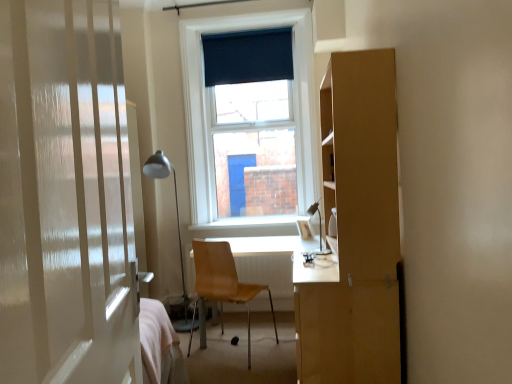
The height and width of the screenshot is (384, 512). Describe the element at coordinates (248, 56) in the screenshot. I see `dark blue fabric at upper center` at that location.

Where is `wooden chair at center`? The width and height of the screenshot is (512, 384). wooden chair at center is located at coordinates (223, 282).

Locate an element on the screen. Image resolution: width=512 pixels, height=384 pixels. matte silver table lamp at center, which appears as the 2th table lamp when viewed from the left is located at coordinates (319, 228).

Describe the element at coordinates (177, 225) in the screenshot. I see `metallic silver table lamp at left, arranged as the 2th table lamp when viewed from the front` at that location.

What do you see at coordinates (65, 196) in the screenshot?
I see `white glossy door at left` at bounding box center [65, 196].

The image size is (512, 384). I want to click on white smooth window sill at center, so click(x=248, y=226).

Identify the location of dark blue fabric at upper center. (248, 56).

Is point (119, 212) positioned after point (215, 83)?

No, it is not.

Between white glossy door at left and dark blue fabric at upper center, which one appears on the left side from the viewer's perspective?

white glossy door at left.

Which object is wider, white glossy door at left or dark blue fabric at upper center?

Wider between the two is white glossy door at left.

Locate an element on the screen. Image resolution: width=512 pixels, height=384 pixels. door located above the wooden chair at center (from the image's perspective) is located at coordinates (65, 196).

How different are the orientations of wooden chair at center and white glossy door at left in degrees?

They differ by 53.8 degrees in their facing directions.

From the image's perspective, which one is positioned lower, wooden chair at center or white glossy door at left?

From the image's view, wooden chair at center is below.

Does wooden chair at center touch white glossy door at left?

No, wooden chair at center is not next to white glossy door at left.

Looking at the image, does dark blue fabric at upper center seem bigger or smaller compared to metallic silver table lamp at left, placed as the second table lamp when sorted from right to left?

dark blue fabric at upper center is smaller than metallic silver table lamp at left, placed as the second table lamp when sorted from right to left.

What are the coordinates of `curtain above the metallic silver table lamp at left, acting as the 1th table lamp starting from the back (from a real-world perspective)` in the screenshot? It's located at pyautogui.click(x=248, y=56).

Does dark blue fabric at upper center have a greater width compared to metallic silver table lamp at left, placed as the second table lamp when sorted from right to left?

No.

Is metallic silver table lamp at left, arranged as the 2th table lamp when viewed from the front, turned away from matte silver table lamp at center, which appears as the 2th table lamp when viewed from the left?

metallic silver table lamp at left, arranged as the 2th table lamp when viewed from the front, does not have its back to matte silver table lamp at center, which appears as the 2th table lamp when viewed from the left.

From the image's perspective, relative to matte silver table lamp at center, which is counted as the first table lamp, starting from the front, is metallic silver table lamp at left, arranged as the 2th table lamp when viewed from the front, above or below?

metallic silver table lamp at left, arranged as the 2th table lamp when viewed from the front, is below matte silver table lamp at center, which is counted as the first table lamp, starting from the front.

From a real-world perspective, is metallic silver table lamp at left, acting as the 1th table lamp starting from the back, positioned under matte silver table lamp at center, which is the first table lamp from right to left, based on gravity?

Yes, from a real-world perspective, metallic silver table lamp at left, acting as the 1th table lamp starting from the back, is beneath matte silver table lamp at center, which is the first table lamp from right to left.

In the scene shown: Does metallic silver table lamp at left, acting as the 1th table lamp starting from the back, come behind matte silver table lamp at center, the second table lamp when ordered from back to front?

Yes, metallic silver table lamp at left, acting as the 1th table lamp starting from the back, is further from the camera.

What's the angular difference between metallic silver table lamp at left, the 1th table lamp in the left-to-right sequence, and light brown wooden desk at center's facing directions?

The angular difference between metallic silver table lamp at left, the 1th table lamp in the left-to-right sequence, and light brown wooden desk at center is 0.000375 degrees.

Considering the sizes of metallic silver table lamp at left, placed as the second table lamp when sorted from right to left, and light brown wooden desk at center in the image, is metallic silver table lamp at left, placed as the second table lamp when sorted from right to left, wider or thinner than light brown wooden desk at center?

Considering their sizes, metallic silver table lamp at left, placed as the second table lamp when sorted from right to left, looks slimmer than light brown wooden desk at center.

Is metallic silver table lamp at left, arranged as the 2th table lamp when viewed from the front, spatially inside light brown wooden desk at center, or outside of it?

metallic silver table lamp at left, arranged as the 2th table lamp when viewed from the front, exists outside the volume of light brown wooden desk at center.

Are metallic silver table lamp at left, the 1th table lamp in the left-to-right sequence, and light brown wooden desk at center far apart?

Yes, metallic silver table lamp at left, the 1th table lamp in the left-to-right sequence, and light brown wooden desk at center are located far from each other.

Is metallic silver table lamp at left, the 1th table lamp in the left-to-right sequence, aimed at white smooth window sill at center?

No, metallic silver table lamp at left, the 1th table lamp in the left-to-right sequence, is not oriented towards white smooth window sill at center.

Is metallic silver table lamp at left, the 1th table lamp in the left-to-right sequence, directly adjacent to white smooth window sill at center?

No, metallic silver table lamp at left, the 1th table lamp in the left-to-right sequence, is not in contact with white smooth window sill at center.

From the image's perspective, relative to white smooth window sill at center, is metallic silver table lamp at left, acting as the 1th table lamp starting from the back, above or below?

From the image's perspective, metallic silver table lamp at left, acting as the 1th table lamp starting from the back, appears below white smooth window sill at center.

Considering the positions of points (177, 331) and (286, 231), is point (177, 331) farther from camera compared to point (286, 231)?

No, (177, 331) is closer to viewer.

In the scene shown: Does matte silver table lamp at center, which appears as the 2th table lamp when viewed from the left, have a lesser width compared to light brown wooden desk at center?

Correct, the width of matte silver table lamp at center, which appears as the 2th table lamp when viewed from the left, is less than that of light brown wooden desk at center.

Considering the sizes of matte silver table lamp at center, which appears as the 2th table lamp when viewed from the left, and light brown wooden desk at center in the image, is matte silver table lamp at center, which appears as the 2th table lamp when viewed from the left, taller or shorter than light brown wooden desk at center?

matte silver table lamp at center, which appears as the 2th table lamp when viewed from the left, is shorter than light brown wooden desk at center.

The image size is (512, 384). Find the location of `table behind the matte silver table lamp at center, which is counted as the first table lamp, starting from the front`. table behind the matte silver table lamp at center, which is counted as the first table lamp, starting from the front is located at coordinates (267, 264).

Is matte silver table lamp at center, which is the first table lamp from right to left, looking in the opposite direction of light brown wooden desk at center?

matte silver table lamp at center, which is the first table lamp from right to left, is not turned away from light brown wooden desk at center.

Where is `curtain on the right of white glossy door at left`? The width and height of the screenshot is (512, 384). curtain on the right of white glossy door at left is located at coordinates (248, 56).

This screenshot has width=512, height=384. What are the coordinates of `door above the wooden chair at center (from a real-world perspective)` in the screenshot? It's located at [65, 196].

Based on their spatial positions, is white smooth window sill at center or wooden chair at center further from dark blue fabric at upper center?

wooden chair at center.

Based on their spatial positions, is wooden chair at center or white glossy door at left closer to light brown wooden desk at center?

Based on the image, wooden chair at center appears to be nearer to light brown wooden desk at center.

Based on their spatial positions, is dark blue fabric at upper center or light brown wooden desk at center further from white glossy door at left?

dark blue fabric at upper center.

Looking at the image, which one is located closer to dark blue fabric at upper center, metallic silver table lamp at left, placed as the second table lamp when sorted from right to left, or matte silver table lamp at center, which appears as the 2th table lamp when viewed from the left?

metallic silver table lamp at left, placed as the second table lamp when sorted from right to left, lies closer to dark blue fabric at upper center than the other object.

From the picture: When comparing their distances from metallic silver table lamp at left, placed as the second table lamp when sorted from right to left, does matte silver table lamp at center, which appears as the 2th table lamp when viewed from the left, or white glossy door at left seem further?

Among the two, white glossy door at left is located further to metallic silver table lamp at left, placed as the second table lamp when sorted from right to left.

Estimate the real-world distances between objects in this image. Which object is further from matte silver table lamp at center, which is counted as the first table lamp, starting from the front, light brown wooden desk at center or white smooth window sill at center?

light brown wooden desk at center lies further to matte silver table lamp at center, which is counted as the first table lamp, starting from the front, than the other object.

Based on their spatial positions, is dark blue fabric at upper center or light brown wooden desk at center further from wooden chair at center?

dark blue fabric at upper center is further to wooden chair at center.

Based on their spatial positions, is dark blue fabric at upper center or wooden chair at center further from white smooth window sill at center?

dark blue fabric at upper center lies further to white smooth window sill at center than the other object.

At what (x,y) coordinates should I click in order to perform the action: click on table lamp located between matte silver table lamp at center, which is the first table lamp from right to left, and white smooth window sill at center in the depth direction. Please return your answer as a coordinate pair (x, y). Looking at the image, I should click on (177, 225).

Find the location of a particular element. table located between metallic silver table lamp at left, placed as the second table lamp when sorted from right to left, and matte silver table lamp at center, which is counted as the first table lamp, starting from the front, in the left-right direction is located at coordinates (267, 264).

Where is `chair located between matte silver table lamp at center, which is counted as the first table lamp, starting from the front, and white smooth window sill at center in the depth direction`? chair located between matte silver table lamp at center, which is counted as the first table lamp, starting from the front, and white smooth window sill at center in the depth direction is located at coordinates (223, 282).

I want to click on chair that lies between matte silver table lamp at center, which appears as the 2th table lamp when viewed from the left, and light brown wooden desk at center from top to bottom, so click(x=223, y=282).